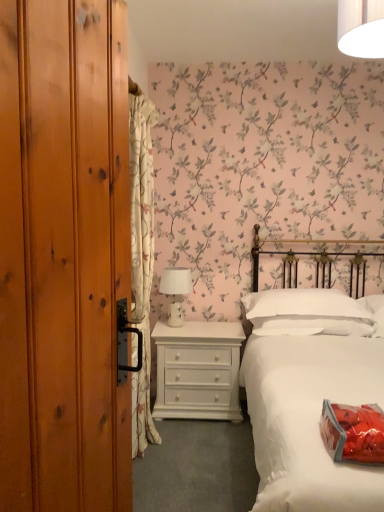
Question: Considering the positions of white cotton bed at center and white ceramic table lamp at center in the image, is white cotton bed at center wider or thinner than white ceramic table lamp at center?

Choices:
 (A) wide
 (B) thin

Answer: (A)

Question: From the image's perspective, relative to white ceramic table lamp at center, is white cotton bed at center above or below?

Choices:
 (A) above
 (B) below

Answer: (B)

Question: Based on their relative distances, which object is nearer to the white ceramic table lamp at center?

Choices:
 (A) white painted wood chest of drawers at center
 (B) white glossy dresser at center
 (C) white floral fabric curtain at left
 (D) white cotton bed at center
 (E) white soft pillow at center

Answer: (A)

Question: Which object is the farthest from the white ceramic table lamp at center?

Choices:
 (A) white cotton bed at center
 (B) white painted wood chest of drawers at center
 (C) white floral fabric curtain at left
 (D) white glossy dresser at center
 (E) white soft pillow at center

Answer: (D)